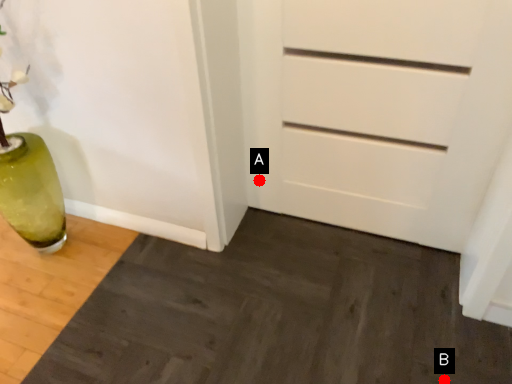
Question: Two points are circled on the image, labeled by A and B beside each circle. Which point is closer to the camera?

Choices:
 (A) A is closer
 (B) B is closer

Answer: (B)